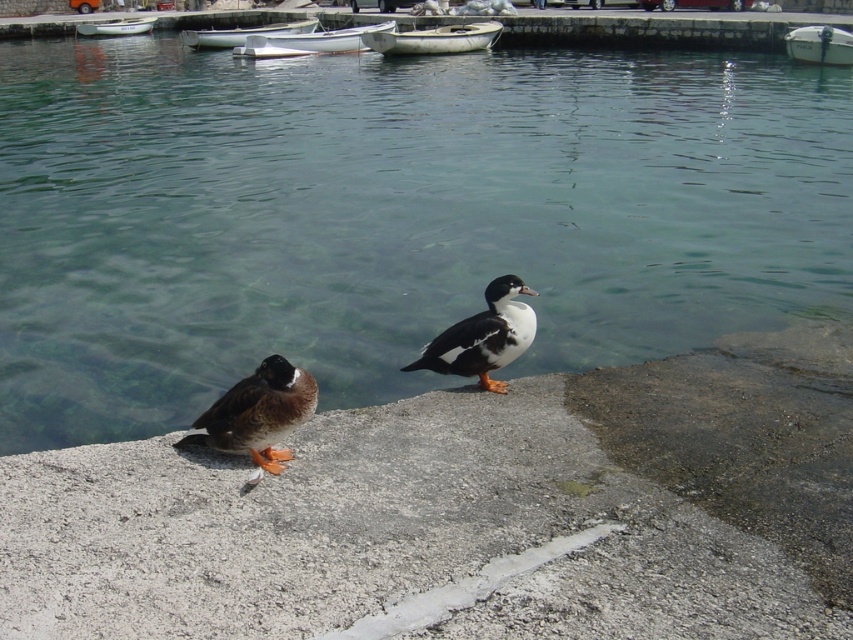
Question: Which point is farther from the camera taking this photo?

Choices:
 (A) tap(219, 448)
 (B) tap(321, 515)
 (C) tap(822, 38)

Answer: (C)

Question: Can you confirm if brown feathered duck at lower left is bigger than white plastic boat at upper right?

Choices:
 (A) yes
 (B) no

Answer: (B)

Question: Which object is farther from the camera taking this photo?

Choices:
 (A) clear water at center
 (B) white and black duck at center
 (C) white plastic boat at upper right
 (D) gray concrete at center

Answer: (C)

Question: Is white and black duck at center above white plastic boat at center?

Choices:
 (A) yes
 (B) no

Answer: (B)

Question: Which object appears farthest from the camera in this image?

Choices:
 (A) white and black duck at center
 (B) clear water at center

Answer: (B)

Question: Is clear water at center thinner than white plastic boat at upper left?

Choices:
 (A) no
 (B) yes

Answer: (A)